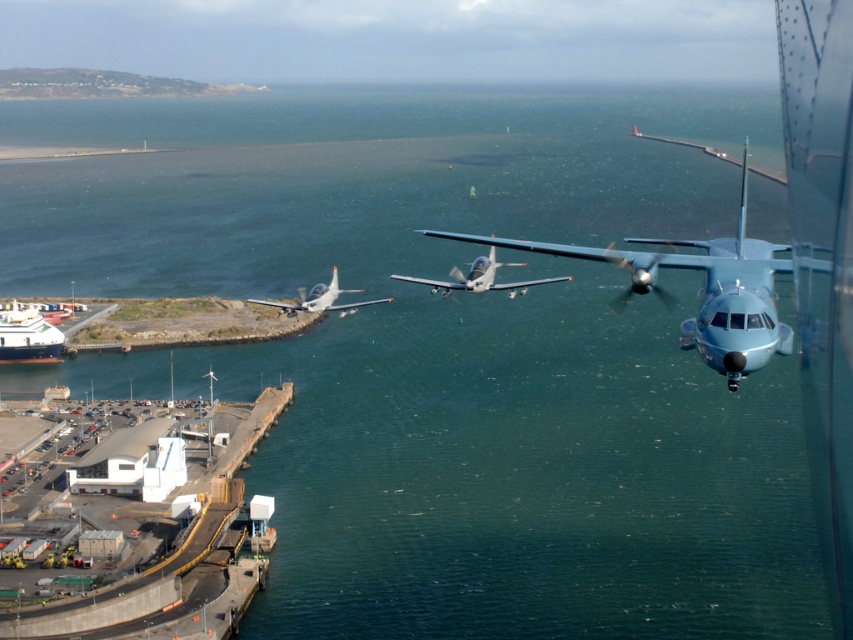
Question: Does metallic blue airplane at upper right have a greater width compared to silver metallic airplane at center?

Choices:
 (A) yes
 (B) no

Answer: (A)

Question: Among these objects, which one is nearest to the camera?

Choices:
 (A) metallic gray airplane at center
 (B) white glossy ship at lower left

Answer: (A)

Question: Which point is closer to the camera?

Choices:
 (A) white concrete dock at lower left
 (B) metallic blue airplane at upper right
 (C) white glossy ship at lower left

Answer: (B)

Question: Estimate the real-world distances between objects in this image. Which object is farther from the silver metallic airplane at center?

Choices:
 (A) metallic blue airplane at upper right
 (B) metallic gray airplane at center
 (C) white concrete dock at lower left

Answer: (A)

Question: Can you confirm if white concrete dock at lower left is positioned above white glossy ship at lower left?

Choices:
 (A) yes
 (B) no

Answer: (B)

Question: Does metallic blue airplane at upper right appear over silver metallic airplane at center?

Choices:
 (A) no
 (B) yes

Answer: (B)